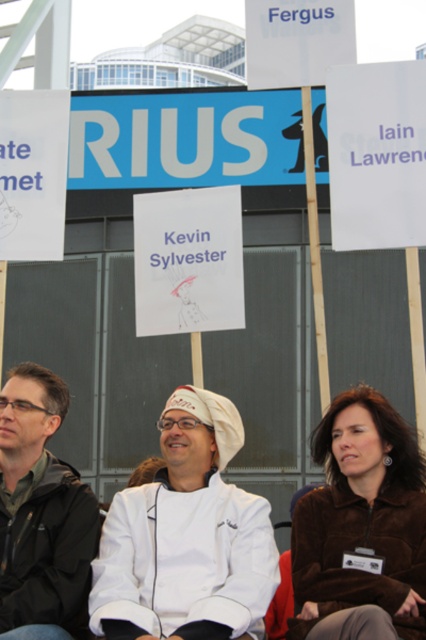
Question: Considering the real-world distances, which object is farthest from the white paper sign at upper right?

Choices:
 (A) green matte jacket at left
 (B) white matte chef coat at center
 (C) brown fuzzy jacket at lower right

Answer: (A)

Question: Can you confirm if green matte jacket at left is bigger than white paper sign at upper center?

Choices:
 (A) no
 (B) yes

Answer: (B)

Question: Which point is closer to the camera taking this photo?

Choices:
 (A) (178, 172)
 (B) (265, 513)
 (C) (339, 506)

Answer: (B)

Question: Which object appears closest to the camera in this image?

Choices:
 (A) white paper at left
 (B) white paper at center

Answer: (A)

Question: Is blue plastic sign at upper center to the right of white paper sign at upper right from the viewer's perspective?

Choices:
 (A) no
 (B) yes

Answer: (A)

Question: Can you confirm if white paper at center is positioned above white paper at left?

Choices:
 (A) yes
 (B) no

Answer: (B)